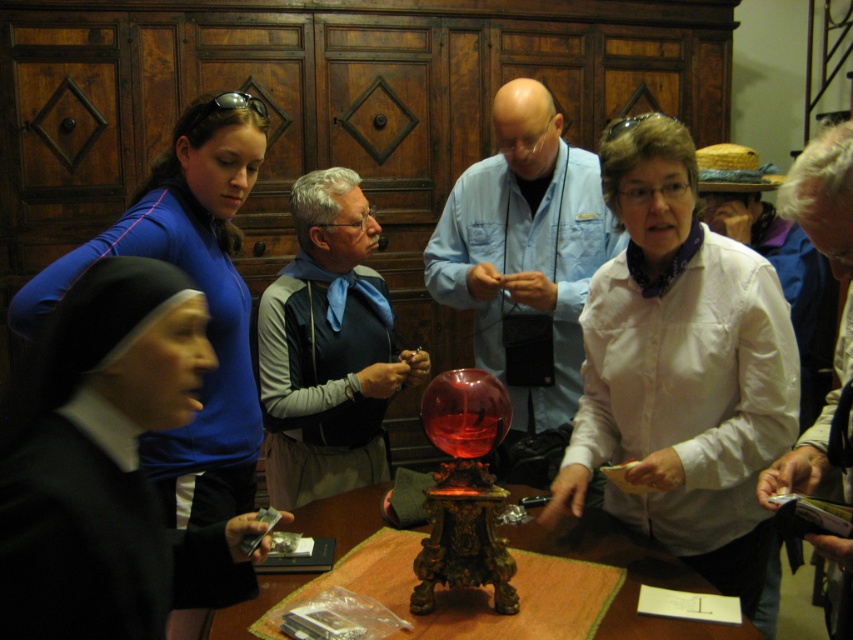
Who is higher up, blue fabric vest at center or brown wooden table at center?

Positioned higher is blue fabric vest at center.

Does blue fabric vest at center appear on the left side of brown wooden table at center?

Yes, blue fabric vest at center is to the left of brown wooden table at center.

Where is `blue fabric vest at center`? This screenshot has width=853, height=640. blue fabric vest at center is located at coordinates (328, 348).

Which is in front, point (750, 522) or point (268, 356)?

Point (750, 522) is in front.

Is white satin blouse at center closer to camera compared to blue fabric vest at center?

Yes, white satin blouse at center is closer to the viewer.

What do you see at coordinates (682, 369) in the screenshot?
I see `white satin blouse at center` at bounding box center [682, 369].

Find the location of `white satin blouse at center`. white satin blouse at center is located at coordinates (682, 369).

Which is in front, point (689, 452) or point (161, 253)?

Point (689, 452)

Who is lower down, white satin blouse at center or black satin habit at left?

white satin blouse at center is below.

Locate an element on the screen. white satin blouse at center is located at coordinates (682, 369).